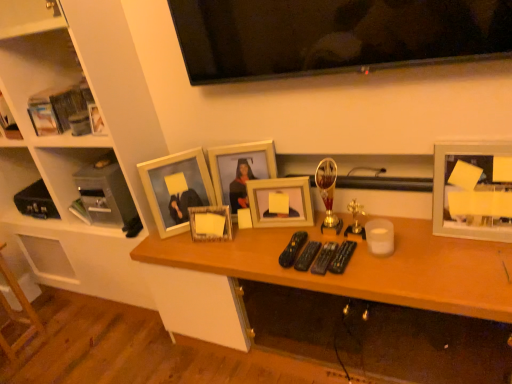
Describe the element at coordinates (333, 35) in the screenshot. This screenshot has width=512, height=384. I see `flat screen tv at upper center` at that location.

What do you see at coordinates (473, 191) in the screenshot? Image resolution: width=512 pixels, height=384 pixels. I see `white matte picture frame at right, acting as the fifth picture frame starting from the left` at bounding box center [473, 191].

You are a GUI agent. You are given a task and a screenshot of the screen. Output one action in this format:
    pyautogui.click(x=<x>, y=<y>)
    Task: Click on the hardcover book at left
    
    Given the screenshot: What is the action you would take?
    pyautogui.click(x=58, y=108)

This screenshot has height=384, width=512. Describe the element at coordinates (58, 108) in the screenshot. I see `hardcover book at left` at that location.

What are the coordinates of `matte wooden picture frame at center, the 2th picture frame viewed from the right` in the screenshot? It's located at (280, 202).

Describe the element at coordinates (80, 143) in the screenshot. I see `white wood shelf at upper left, acting as the 1th furniture starting from the top` at that location.

Identify the location of flat screen tv at upper center. The height and width of the screenshot is (384, 512). (333, 35).

From the image's perspective, is matte wooden picture frame at center, arranged as the 1th picture frame when viewed from the left, above or below matte gray cabinet at left?

Based on their image positions, matte wooden picture frame at center, arranged as the 1th picture frame when viewed from the left, is located beneath matte gray cabinet at left.

This screenshot has height=384, width=512. Find the location of `the 1st picture frame in front of the matte gray cabinet at left, counting from the anchor's position`. the 1st picture frame in front of the matte gray cabinet at left, counting from the anchor's position is located at coordinates (176, 189).

Is matte wooden picture frame at center, arranged as the 1th picture frame when viewed from the left, looking in the opposite direction of matte gray cabinet at left?

That's not correct — matte wooden picture frame at center, arranged as the 1th picture frame when viewed from the left, is not looking away from matte gray cabinet at left.

Is matte wooden picture frame at center, which appears as the 5th picture frame when viewed from the right, in front of matte gray cabinet at left?

Yes, the depth of matte wooden picture frame at center, which appears as the 5th picture frame when viewed from the right, is less than that of matte gray cabinet at left.

Is hardcover book at left spatially inside matte wooden picture frame at center, which appears as the 5th picture frame when viewed from the right, or outside of it?

hardcover book at left is located beyond the bounds of matte wooden picture frame at center, which appears as the 5th picture frame when viewed from the right.

Is hardcover book at left to the right of matte wooden picture frame at center, which appears as the 5th picture frame when viewed from the right, from the viewer's perspective?

In fact, hardcover book at left is to the left of matte wooden picture frame at center, which appears as the 5th picture frame when viewed from the right.

This screenshot has width=512, height=384. Find the location of `picture frame that is the 3rd object located below the hardcover book at left (from the image's perspective)`. picture frame that is the 3rd object located below the hardcover book at left (from the image's perspective) is located at coordinates (176, 189).

Can you confirm if hardcover book at left is thinner than matte wooden picture frame at center, arranged as the 1th picture frame when viewed from the left?

Incorrect, the width of hardcover book at left is not less than that of matte wooden picture frame at center, arranged as the 1th picture frame when viewed from the left.

Based on the photo, looking at the image, does flat screen tv at upper center seem bigger or smaller compared to wooden picture frame at center, the 4th picture frame in the right-to-left sequence?

flat screen tv at upper center is bigger than wooden picture frame at center, the 4th picture frame in the right-to-left sequence.

Looking at this image, is flat screen tv at upper center outside of wooden picture frame at center, which is the second picture frame from left to right?

Yes, flat screen tv at upper center is outside of wooden picture frame at center, which is the second picture frame from left to right.

In terms of width, does flat screen tv at upper center look wider or thinner when compared to wooden picture frame at center, which is the second picture frame from left to right?

flat screen tv at upper center is wider than wooden picture frame at center, which is the second picture frame from left to right.

Is the position of flat screen tv at upper center less distant than that of wooden picture frame at center, which is the second picture frame from left to right?

Yes, the depth of flat screen tv at upper center is less than that of wooden picture frame at center, which is the second picture frame from left to right.

Is matte wooden picture frame at center, which appears as the 5th picture frame when viewed from the right, at the left side of matte wooden picture frame at center, the 2th picture frame viewed from the right?

Yes.

Between point (203, 161) and point (297, 182), which one is positioned behind?

The point (203, 161) is behind.

From the image's perspective, which one is positioned higher, matte wooden picture frame at center, arranged as the 1th picture frame when viewed from the left, or matte wooden picture frame at center, the 2th picture frame viewed from the right?

From the image's view, matte wooden picture frame at center, arranged as the 1th picture frame when viewed from the left, is above.

Is matte wooden picture frame at center, which appears as the 5th picture frame when viewed from the right, far away from matte wooden picture frame at center, the 4th picture frame from the left?

No, there isn't a large distance between matte wooden picture frame at center, which appears as the 5th picture frame when viewed from the right, and matte wooden picture frame at center, the 4th picture frame from the left.

Can you see matte wooden picture frame at center, which is the third picture frame in left-to-right order, touching white wood shelf at upper left, which is the second furniture from bottom to top?

No, matte wooden picture frame at center, which is the third picture frame in left-to-right order, is not in contact with white wood shelf at upper left, which is the second furniture from bottom to top.

From the image's perspective, does matte wooden picture frame at center, which is the third picture frame in left-to-right order, appear lower than white wood shelf at upper left, acting as the 1th furniture starting from the top?

Yes, from the image's perspective, matte wooden picture frame at center, which is the third picture frame in left-to-right order, is beneath white wood shelf at upper left, acting as the 1th furniture starting from the top.

Between matte wooden picture frame at center, which is the third picture frame in left-to-right order, and white wood shelf at upper left, which is the second furniture from bottom to top, which one has less height?

With less height is matte wooden picture frame at center, which is the third picture frame in left-to-right order.

Considering the positions of objects matte wooden picture frame at center, which is the third picture frame in left-to-right order, and white wood shelf at upper left, which is the second furniture from bottom to top, in the image provided, who is more to the left, matte wooden picture frame at center, which is the third picture frame in left-to-right order, or white wood shelf at upper left, which is the second furniture from bottom to top,?

white wood shelf at upper left, which is the second furniture from bottom to top, is more to the left.

Considering the positions of points (36, 328) and (467, 160), is point (36, 328) farther from camera compared to point (467, 160)?

Yes.

Is wooden stool at lower left, the 1th furniture when ordered from bottom to top, outside of white matte picture frame at right, acting as the fifth picture frame starting from the left?

Yes, wooden stool at lower left, the 1th furniture when ordered from bottom to top, is outside of white matte picture frame at right, acting as the fifth picture frame starting from the left.

Which of these two, wooden stool at lower left, which ranks as the second furniture in top-to-bottom order, or white matte picture frame at right, acting as the fifth picture frame starting from the left, is thinner?

Thinner between the two is white matte picture frame at right, acting as the fifth picture frame starting from the left.

From the image's perspective, between wooden stool at lower left, the 1th furniture when ordered from bottom to top, and white matte picture frame at right, the 1th picture frame in the right-to-left sequence, which one is located above?

white matte picture frame at right, the 1th picture frame in the right-to-left sequence.

From a real-world perspective, between white wood shelf at upper left, acting as the 1th furniture starting from the top, and matte wooden picture frame at center, arranged as the 1th picture frame when viewed from the left, who is vertically lower?

In real-world perspective, matte wooden picture frame at center, arranged as the 1th picture frame when viewed from the left, is lower.

Is white wood shelf at upper left, which is the second furniture from bottom to top, bigger than matte wooden picture frame at center, arranged as the 1th picture frame when viewed from the left?

Yes.

From the image's perspective, which one is positioned lower, white wood shelf at upper left, acting as the 1th furniture starting from the top, or matte wooden picture frame at center, which appears as the 5th picture frame when viewed from the right?

matte wooden picture frame at center, which appears as the 5th picture frame when viewed from the right, is shown below in the image.

Where is `cabinet behind the matte wooden picture frame at center, arranged as the 1th picture frame when viewed from the left`? Image resolution: width=512 pixels, height=384 pixels. cabinet behind the matte wooden picture frame at center, arranged as the 1th picture frame when viewed from the left is located at coordinates [92, 185].

Where is `the 1st picture frame to the right of the hardcover book at left, counting from the anchor's position`? This screenshot has width=512, height=384. the 1st picture frame to the right of the hardcover book at left, counting from the anchor's position is located at coordinates (176, 189).

From the image, which object appears to be nearer to white wood shelf at upper left, which is the second furniture from bottom to top, matte wooden picture frame at center, arranged as the 1th picture frame when viewed from the left, or wooden picture frame at center, which is the second picture frame from left to right?

matte wooden picture frame at center, arranged as the 1th picture frame when viewed from the left, is positioned closer to the anchor white wood shelf at upper left, which is the second furniture from bottom to top.

Which object lies further to the anchor point wooden picture frame at center, which is the second picture frame from left to right, white matte picture frame at right, acting as the fifth picture frame starting from the left, or wooden desk at center?

white matte picture frame at right, acting as the fifth picture frame starting from the left, lies further to wooden picture frame at center, which is the second picture frame from left to right, than the other object.

When comparing their distances from flat screen tv at upper center, does white matte picture frame at right, the 1th picture frame in the right-to-left sequence, or matte wooden picture frame at center, arranged as the 1th picture frame when viewed from the left, seem closer?

white matte picture frame at right, the 1th picture frame in the right-to-left sequence, is closer to flat screen tv at upper center.

Estimate the real-world distances between objects in this image. Which object is closer to matte wooden picture frame at center, the 2th picture frame viewed from the right, matte wooden picture frame at center, which appears as the 5th picture frame when viewed from the right, or flat screen tv at upper center?

matte wooden picture frame at center, which appears as the 5th picture frame when viewed from the right, is closer to matte wooden picture frame at center, the 2th picture frame viewed from the right.

Looking at the image, which one is located further to white wood shelf at upper left, which is the second furniture from bottom to top, wooden stool at lower left, which ranks as the second furniture in top-to-bottom order, or matte wooden picture frame at center, the 3th picture frame when ordered from right to left?

wooden stool at lower left, which ranks as the second furniture in top-to-bottom order, is positioned further to the anchor white wood shelf at upper left, which is the second furniture from bottom to top.

Which object lies further to the anchor point matte wooden picture frame at center, the 2th picture frame viewed from the right, matte gray cabinet at left or wooden desk at center?

matte gray cabinet at left.

Which object lies nearer to the anchor point flat screen tv at upper center, white wood shelf at upper left, acting as the 1th furniture starting from the top, or matte wooden picture frame at center, the 3th picture frame when ordered from right to left?

matte wooden picture frame at center, the 3th picture frame when ordered from right to left, is closer to flat screen tv at upper center.

Based on the photo, when comparing their distances from wooden picture frame at center, the 4th picture frame in the right-to-left sequence, does matte wooden picture frame at center, which is the third picture frame in left-to-right order, or wooden stool at lower left, which ranks as the second furniture in top-to-bottom order, seem further?

Based on the image, wooden stool at lower left, which ranks as the second furniture in top-to-bottom order, appears to be further to wooden picture frame at center, the 4th picture frame in the right-to-left sequence.

The height and width of the screenshot is (384, 512). Find the location of `furniture between hardcover book at left and wooden stool at lower left, the 1th furniture when ordered from bottom to top, from top to bottom`. furniture between hardcover book at left and wooden stool at lower left, the 1th furniture when ordered from bottom to top, from top to bottom is located at coordinates (80, 143).

Locate an element on the screen. This screenshot has height=384, width=512. television between matte gray cabinet at left and white matte picture frame at right, the 1th picture frame in the right-to-left sequence is located at coordinates (333, 35).

Image resolution: width=512 pixels, height=384 pixels. Identify the location of cabinet between white wood shelf at upper left, which is the second furniture from bottom to top, and matte wooden picture frame at center, the 2th picture frame viewed from the right. (92, 185).

You are a GUI agent. You are given a task and a screenshot of the screen. Output one action in this format:
    pyautogui.click(x=<x>, y=<y>)
    Task: Click on the picture frame located between matte gray cabinet at left and wooden picture frame at center, which is the second picture frame from left to right, in the left-right direction
    This screenshot has width=512, height=384.
    Given the screenshot: What is the action you would take?
    pyautogui.click(x=176, y=189)